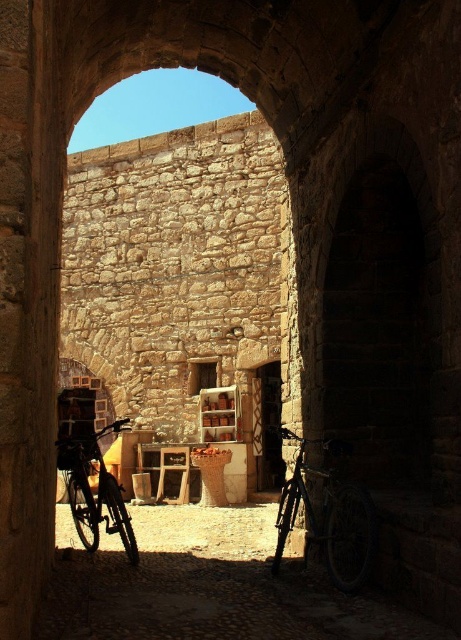
You are standing in the courtyard looking through the arched stone doorway. You notice two points marked in the scene. The first point is at coordinates point (108, 589) and the second is at point (289, 508). If you were to walk towards the first point, would you be moving towards the doorway or away from it?

The point (108, 589) is in front of point (289, 508). Since you are standing in the courtyard looking through the doorway, moving towards the first point would mean moving towards the doorway.